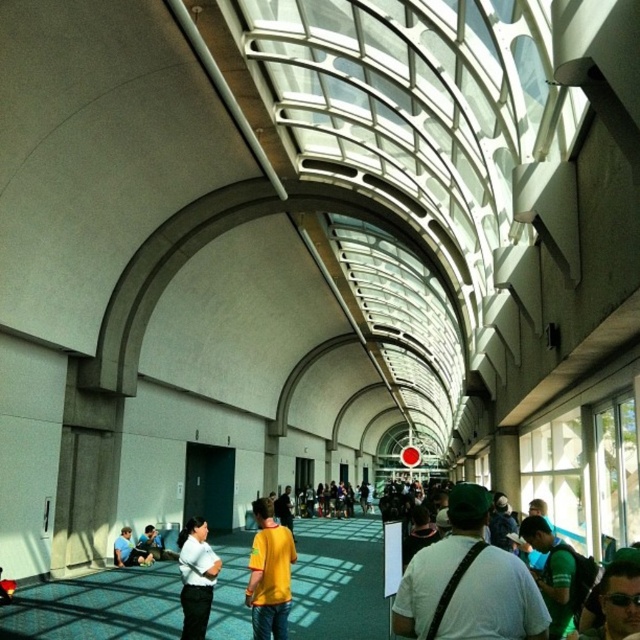
Is white matte shirt at center taller than yellow t-shirt at center?

Indeed, white matte shirt at center has a greater height compared to yellow t-shirt at center.

Is white matte shirt at center bigger than yellow t-shirt at center?

Yes.

Which is in front, point (182, 579) or point (154, 532)?

Positioned in front is point (182, 579).

This screenshot has height=640, width=640. Identify the location of white matte shirt at center. (196, 577).

Between point (554, 563) and point (170, 536), which one is positioned behind?

Positioned behind is point (170, 536).

Which is more to the left, green fabric shirt at lower right or yellow t-shirt at center?

From the viewer's perspective, yellow t-shirt at center appears more on the left side.

Who is more forward, (564, 560) or (150, 525)?

Point (564, 560) is in front.

Image resolution: width=640 pixels, height=640 pixels. I want to click on green fabric shirt at lower right, so [x=552, y=573].

Between white matte t-shirt at center and yellow t-shirt at center, which one appears on the right side from the viewer's perspective?

white matte t-shirt at center is more to the right.

Does white matte t-shirt at center appear on the left side of yellow t-shirt at center?

No, white matte t-shirt at center is not to the left of yellow t-shirt at center.

The image size is (640, 640). I want to click on white matte t-shirt at center, so click(496, 602).

Locate an element on the screen. This screenshot has width=640, height=640. white matte t-shirt at center is located at coordinates (496, 602).